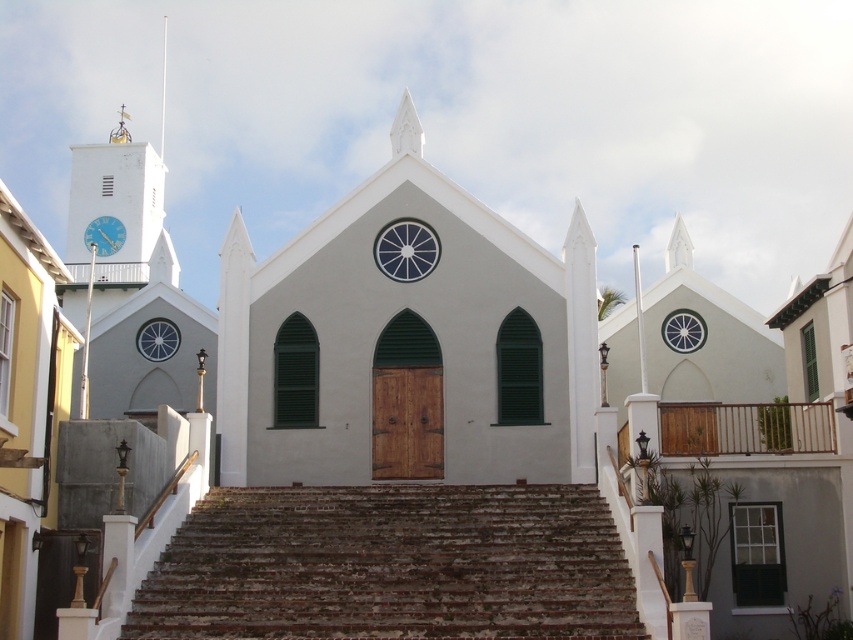
Between brown stone stairs at center and matte glass clock at left, which one is positioned higher?

matte glass clock at left

Who is more forward, (413,608) or (175,342)?

Point (413,608) is in front.

Which is in front, point (393, 589) or point (143, 324)?

Point (393, 589) is more forward.

The height and width of the screenshot is (640, 853). Identify the location of brown stone stairs at center. (392, 564).

Who is higher up, white glass clock at upper center or metallic blue clock at upper left?

Positioned higher is metallic blue clock at upper left.

Is white glass clock at upper center below metallic blue clock at upper left?

Yes.

Which is in front, point (660, 332) or point (119, 240)?

Positioned in front is point (660, 332).

Locate an element on the screen. white glass clock at upper center is located at coordinates [x=683, y=330].

Can you confirm if matte glass clock at left is positioned to the left of smooth white spire at upper center?

No, matte glass clock at left is not to the left of smooth white spire at upper center.

Which is behind, point (163, 323) or point (163, 52)?

Point (163, 52)

Which is in front, point (161, 340) or point (161, 115)?

Point (161, 340) is more forward.

Find the location of `matte glass clock at left`. matte glass clock at left is located at coordinates (157, 339).